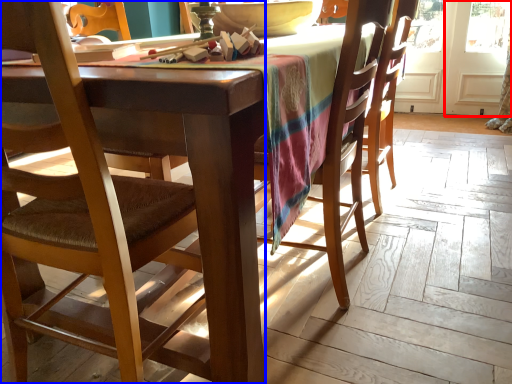
Question: Which of the following is the closest to the observer, screen door (highlighted by a red box) or chair (highlighted by a blue box)?

Choices:
 (A) screen door
 (B) chair

Answer: (B)